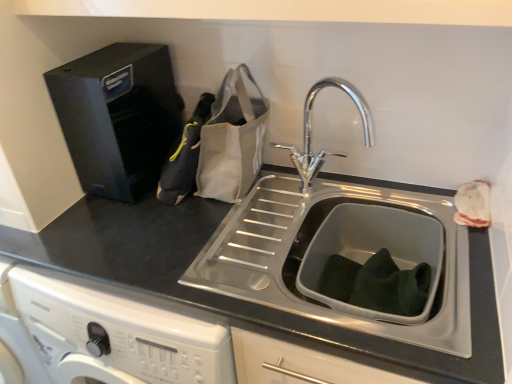
Image resolution: width=512 pixels, height=384 pixels. I want to click on black plastic water dispenser at upper left, so click(x=118, y=117).

The height and width of the screenshot is (384, 512). What are the coordinates of `canvas tote bag at center` in the screenshot? It's located at (232, 140).

From the picture: From a real-world perspective, is canvas tote bag at center physically below black matte countertop at center?

No, from a real-world perspective, canvas tote bag at center is not under black matte countertop at center.

Can you tell me how much canvas tote bag at center and black matte countertop at center differ in facing direction?

The angular difference between canvas tote bag at center and black matte countertop at center is 1.33 degrees.

Are canvas tote bag at center and black matte countertop at center located far from each other?

That's not correct — canvas tote bag at center is a little close to black matte countertop at center.

Does canvas tote bag at center turn towards chrome metallic faucet at center?

No, canvas tote bag at center is not turned towards chrome metallic faucet at center.

Who is bigger, canvas tote bag at center or chrome metallic faucet at center?

Bigger between the two is canvas tote bag at center.

How distant is canvas tote bag at center from chrome metallic faucet at center?

A distance of 7.54 inches exists between canvas tote bag at center and chrome metallic faucet at center.

From a real-world perspective, who is located higher, canvas tote bag at center or chrome metallic faucet at center?

canvas tote bag at center, from a real-world perspective.

Is black matte countertop at center positioned with its back to black plastic water dispenser at upper left?

No.

From the image's perspective, between black matte countertop at center and black plastic water dispenser at upper left, who is located below?

black matte countertop at center.

Which object is wider, black matte countertop at center or black plastic water dispenser at upper left?

With larger width is black matte countertop at center.

Locate an element on the screen. This screenshot has width=512, height=384. appliance that is behind the black matte countertop at center is located at coordinates (118, 117).

From a real-world perspective, is chrome metallic faucet at center positioned above or below black fabric bag at left?

In terms of real-world spatial position, chrome metallic faucet at center is above black fabric bag at left.

Based on the photo, looking at their sizes, would you say chrome metallic faucet at center is wider or thinner than black fabric bag at left?

chrome metallic faucet at center is thinner than black fabric bag at left.

Who is bigger, chrome metallic faucet at center or black fabric bag at left?

Bigger between the two is chrome metallic faucet at center.

Does canvas tote bag at center have a greater height compared to black fabric bag at left?

Correct, canvas tote bag at center is much taller as black fabric bag at left.

Is canvas tote bag at center oriented away from black fabric bag at left?

No, canvas tote bag at center is not facing away from black fabric bag at left.

Can you tell me how much canvas tote bag at center and black fabric bag at left differ in facing direction?

70.9 degrees separate the facing orientations of canvas tote bag at center and black fabric bag at left.

In the image, there is a canvas tote bag at center. Identify the location of bottle below it (from the image's perspective). This screenshot has height=384, width=512. (184, 157).

Considering the positions of points (68, 129) and (201, 106), is point (68, 129) farther from camera compared to point (201, 106)?

No, it is in front of (201, 106).

From the image's perspective, is black plastic water dispenser at upper left on top of black fabric bag at left?

Correct, black plastic water dispenser at upper left appears higher than black fabric bag at left in the image.

Relative to black fabric bag at left, is black plastic water dispenser at upper left in front or behind?

Visually, black plastic water dispenser at upper left is located in front of black fabric bag at left.

How different are the orientations of black plastic water dispenser at upper left and black fabric bag at left in degrees?

The facing directions of black plastic water dispenser at upper left and black fabric bag at left are 73.5 degrees apart.

Considering the sizes of objects chrome metallic faucet at center and black plastic water dispenser at upper left in the image provided, who is wider, chrome metallic faucet at center or black plastic water dispenser at upper left?

Wider between the two is black plastic water dispenser at upper left.

Measure the distance between chrome metallic faucet at center and black plastic water dispenser at upper left.

chrome metallic faucet at center is 17.93 inches from black plastic water dispenser at upper left.

Can you see chrome metallic faucet at center touching black plastic water dispenser at upper left?

No, chrome metallic faucet at center is not beside black plastic water dispenser at upper left.

From the image's perspective, is chrome metallic faucet at center located above black plastic water dispenser at upper left?

Incorrect, from the image's perspective, chrome metallic faucet at center is lower than black plastic water dispenser at upper left.

Locate an element on the screen. Image resolution: width=512 pixels, height=384 pixels. countertop beneath the canvas tote bag at center (from a real-world perspective) is located at coordinates [234, 298].

You are a GUI agent. You are given a task and a screenshot of the screen. Output one action in this format:
    pyautogui.click(x=<x>, y=<y>)
    Task: Click on the paper bag above the chrome metallic faucet at center (from a real-world perspective)
    This screenshot has width=512, height=384.
    Given the screenshot: What is the action you would take?
    pyautogui.click(x=232, y=140)

From the image, which object appears to be farther from canvas tote bag at center, black plastic water dispenser at upper left or chrome metallic faucet at center?

black plastic water dispenser at upper left is further to canvas tote bag at center.

Which object lies further to the anchor point canvas tote bag at center, black matte countertop at center or black fabric bag at left?

Among the two, black matte countertop at center is located further to canvas tote bag at center.

When comparing their distances from black plastic water dispenser at upper left, does canvas tote bag at center or black fabric bag at left seem further?

canvas tote bag at center lies further to black plastic water dispenser at upper left than the other object.

Based on their spatial positions, is black plastic water dispenser at upper left or black fabric bag at left further from chrome metallic faucet at center?

black plastic water dispenser at upper left lies further to chrome metallic faucet at center than the other object.

From the image, which object appears to be farther from chrome metallic faucet at center, black plastic water dispenser at upper left or canvas tote bag at center?

black plastic water dispenser at upper left lies further to chrome metallic faucet at center than the other object.

Based on their spatial positions, is black matte countertop at center or canvas tote bag at center closer to chrome metallic faucet at center?

canvas tote bag at center is closer to chrome metallic faucet at center.

From the image, which object appears to be nearer to black fabric bag at left, black matte countertop at center or chrome metallic faucet at center?

black matte countertop at center is closer to black fabric bag at left.

Considering their positions, is black fabric bag at left positioned further to chrome metallic faucet at center than black matte countertop at center?

black matte countertop at center lies further to chrome metallic faucet at center than the other object.

Identify the location of tap that lies between canvas tote bag at center and black matte countertop at center from top to bottom. (311, 131).

Find the location of a particular element. bottle between black plastic water dispenser at upper left and canvas tote bag at center from left to right is located at coordinates (184, 157).

The width and height of the screenshot is (512, 384). I want to click on paper bag between black fabric bag at left and chrome metallic faucet at center from left to right, so click(x=232, y=140).

What are the coordinates of `paper bag that lies between black plastic water dispenser at upper left and black matte countertop at center from top to bottom` in the screenshot? It's located at (232, 140).